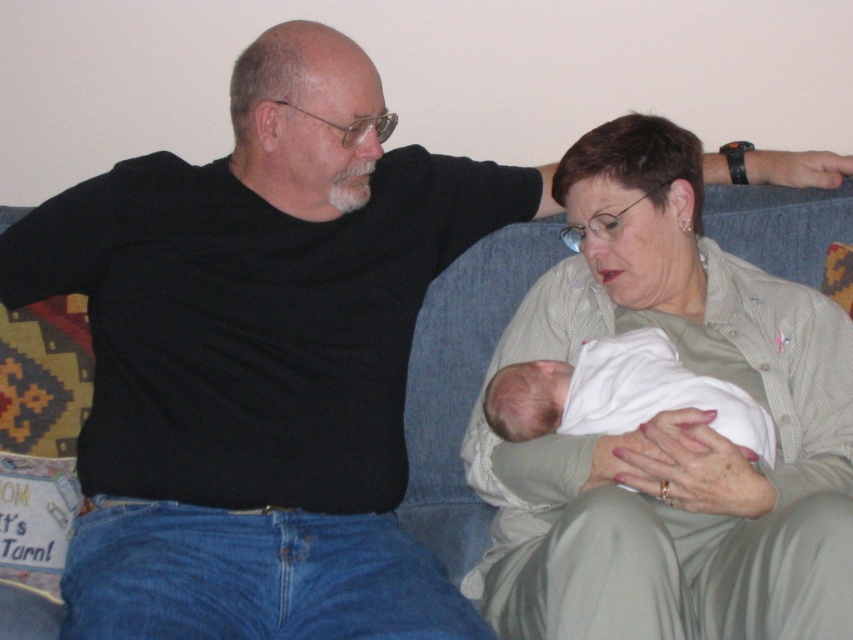
You are a photographer taking a picture of the scene. You notice the light green textured shirt at center and the white soft cloth at center. Which object should you focus on first to ensure both are in sharp focus?

The light green textured shirt at center is closer to the viewer than the white soft cloth at center. To ensure both are in sharp focus, focus on the light green textured shirt at center first, as it is closer, and the depth of field may naturally include the white soft cloth at center in the background.

Where is the light green textured shirt at center located in the image?

The light green textured shirt at center is located at point (664, 424).